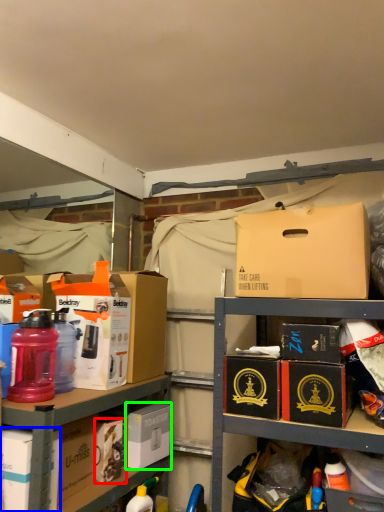
Question: Considering the real-world distances, which object is closest to kit (highlighted by a red box)? box (highlighted by a blue box) or box (highlighted by a green box).

Choices:
 (A) box
 (B) box

Answer: (B)